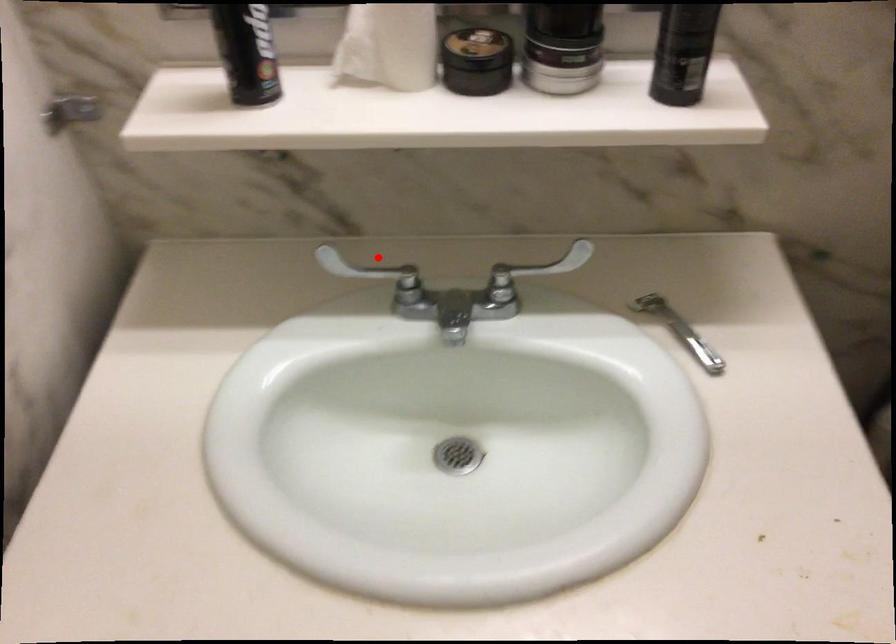
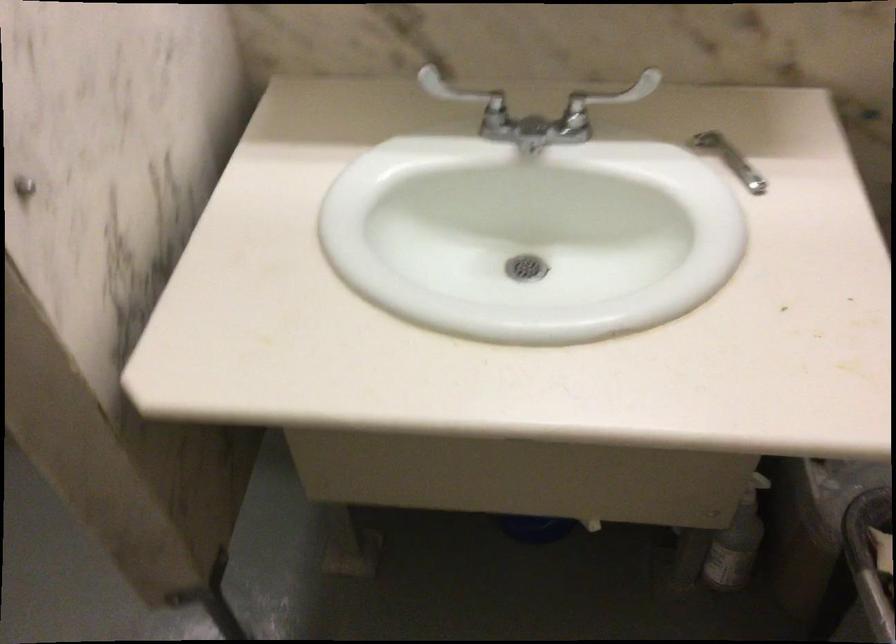
Where in the second image is the point corresponding to the highlighted location from the first image?

(464, 96)